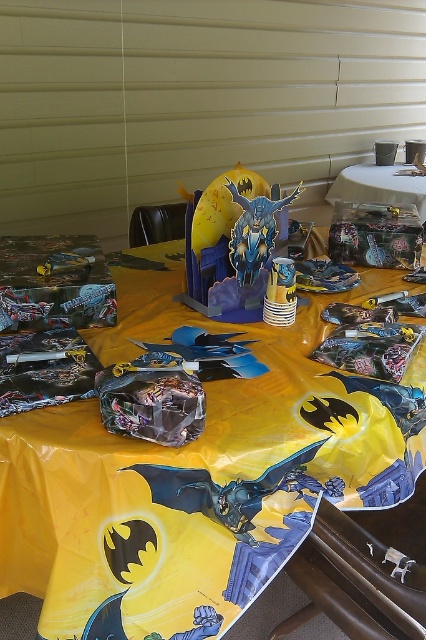
Is point (213, 246) closer to camera compared to point (400, 202)?

Yes, it is in front of point (400, 202).

Is blue plastic batman at center shorter than clear plastic table at upper center?

Yes, blue plastic batman at center is shorter than clear plastic table at upper center.

Is point (239, 280) closer to viewer compared to point (330, 193)?

Yes, it is in front of point (330, 193).

Find the location of a particular element. blue plastic batman at center is located at coordinates (232, 243).

Is yellow plastic tablecloth at center to the right of clear plastic table at upper center from the viewer's perspective?

Incorrect, yellow plastic tablecloth at center is not on the right side of clear plastic table at upper center.

Does yellow plastic tablecloth at center have a larger size compared to clear plastic table at upper center?

Yes.

Which is behind, point (308, 481) or point (414, 168)?

The point (414, 168) is more distant.

Find the location of `yellow plastic tablecloth at center`. yellow plastic tablecloth at center is located at coordinates (192, 476).

Can you confirm if yellow plastic tablecloth at center is smaller than blue plastic batman at center?

No.

Is yellow plastic tablecloth at center shorter than blue plastic batman at center?

No.

Is point (46, 419) positioned in front of point (204, 225)?

Yes, it is.

Identify the location of yellow plastic tablecloth at center. (192, 476).